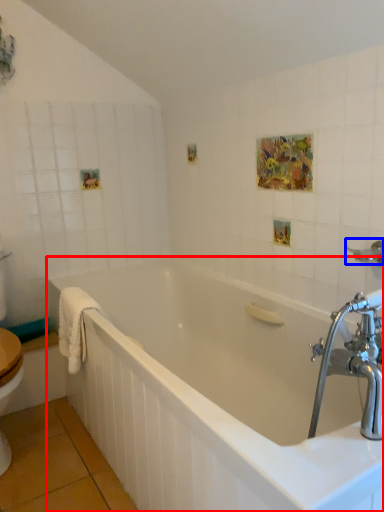
Question: Which object appears farthest to the camera in this image, bathtub (highlighted by a red box) or shower (highlighted by a blue box)?

Choices:
 (A) bathtub
 (B) shower

Answer: (B)